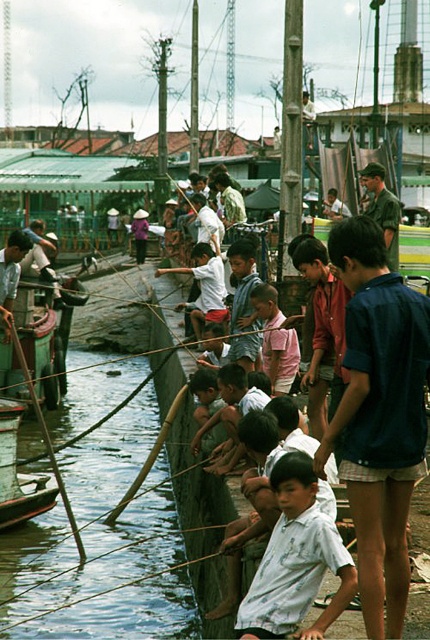
Question: Which point appears farthest from the camera in this image?

Choices:
 (A) (325, 538)
 (B) (27, 609)
 (C) (258, 307)

Answer: (C)

Question: Does white cotton shirt at center have a greater width compared to wooden boat at lower left?

Choices:
 (A) no
 (B) yes

Answer: (B)

Question: Is green bamboo pole at left bigger than white cotton shirt at center?

Choices:
 (A) no
 (B) yes

Answer: (B)

Question: Which point is farther to the camera?

Choices:
 (A) dark blue shirt at center
 (B) white cotton shirt at center
 (C) green bamboo pole at left
 (D) wooden boat at lower left

Answer: (D)

Question: Which object appears closest to the camera in this image?

Choices:
 (A) dark blue shirt at center
 (B) pink cotton shirt at center
 (C) white cotton shirt at center
 (D) green bamboo pole at left

Answer: (C)

Question: Can you confirm if green bamboo pole at left is bigger than dark blue shirt at center?

Choices:
 (A) no
 (B) yes

Answer: (B)